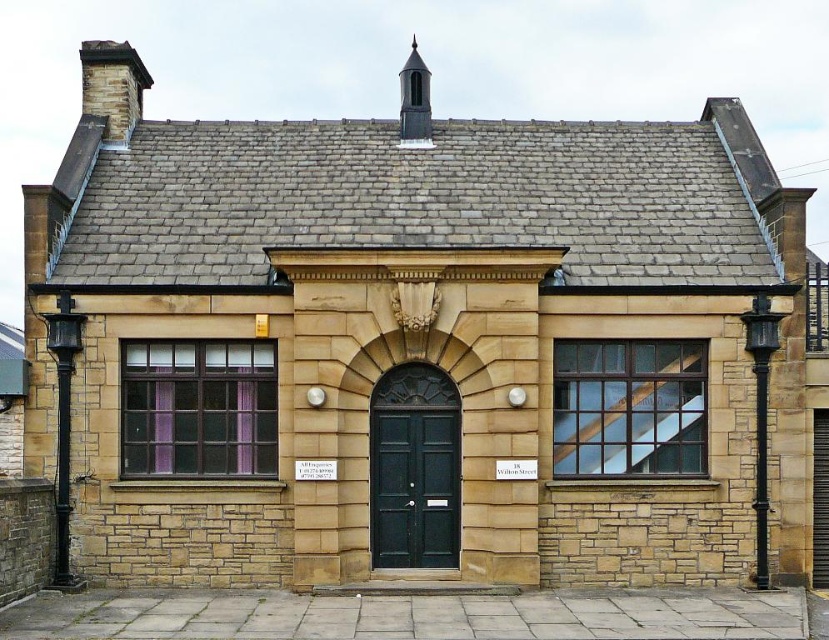
Consider the image. Is brown stone chimney at upper left positioned in front of smooth gray chimney at upper center?

Yes.

Based on the photo, does brown stone chimney at upper left have a lesser height compared to smooth gray chimney at upper center?

No.

Locate an element on the screen. The height and width of the screenshot is (640, 829). brown stone chimney at upper left is located at coordinates click(x=112, y=84).

In order to click on brown stone chimney at upper left in this screenshot , I will do `click(112, 84)`.